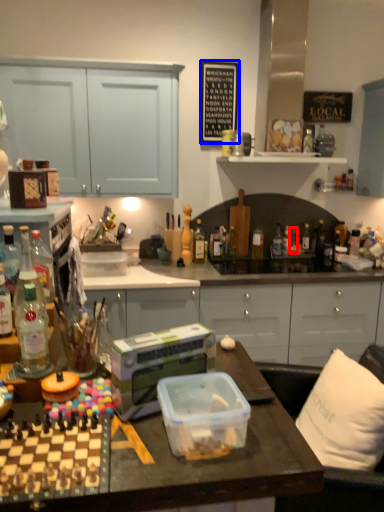
Question: Among these objects, which one is nearest to the camera, bottle (highlighted by a red box) or bulletin board (highlighted by a blue box)?

Choices:
 (A) bottle
 (B) bulletin board

Answer: (B)